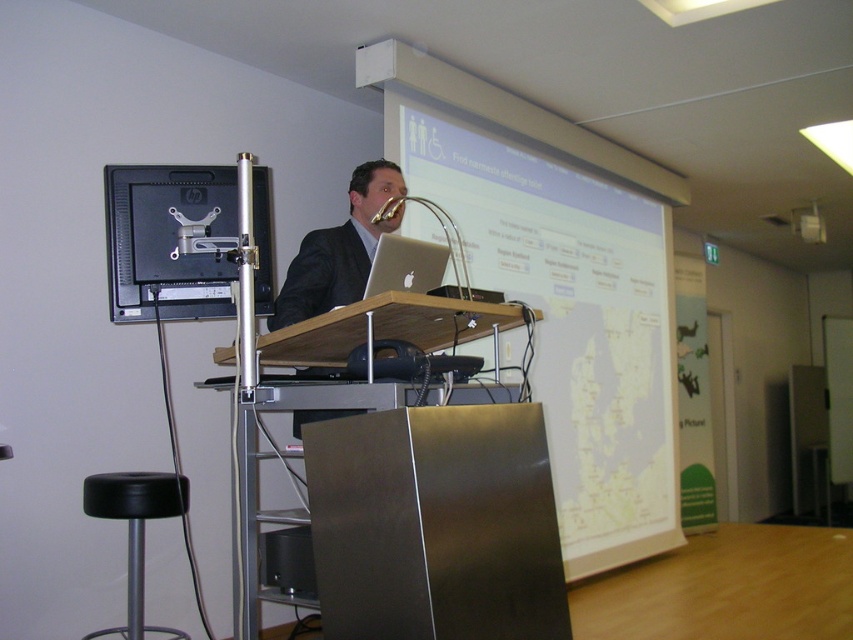
You are organizing a presentation and need to place the silver metallic laptop at center and the metallic silver speaker at lower center on a desk. According to the image, which object is positioned to the left of the other?

The metallic silver speaker at lower center is to the left of the silver metallic laptop at center.

You are setting up a presentation and need to place the silver metallic laptop at center and the metallic silver speaker at lower center on a table. Which object should you place first if you want to ensure there is enough space for both items without overlapping?

The silver metallic laptop at center has a lesser height compared to the metallic silver speaker at lower center. Therefore, you should place the metallic silver speaker at lower center first to ensure there is enough space for the shorter laptop.

You are sitting in the audience and want to point out something on the monitor. Which of the two points, point [408,243] or point [282,529], would appear closer to you on the monitor?

Point [408,243] is closer to the viewer than point [282,529], so it would appear closer on the monitor.